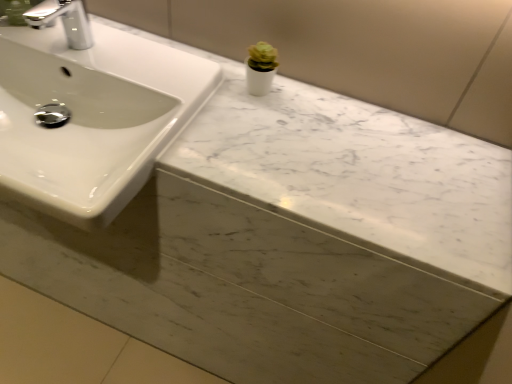
Question: Is silver metallic faucet at upper left looking in the opposite direction of white glossy sink at upper left?

Choices:
 (A) yes
 (B) no

Answer: (B)

Question: From the image's perspective, is silver metallic faucet at upper left on top of white glossy sink at upper left?

Choices:
 (A) yes
 (B) no

Answer: (A)

Question: Does silver metallic faucet at upper left come behind white glossy sink at upper left?

Choices:
 (A) no
 (B) yes

Answer: (B)

Question: Is silver metallic faucet at upper left wider than white glossy sink at upper left?

Choices:
 (A) no
 (B) yes

Answer: (A)

Question: Is silver metallic faucet at upper left far from white glossy sink at upper left?

Choices:
 (A) yes
 (B) no

Answer: (B)

Question: Does silver metallic faucet at upper left lie in front of white glossy sink at upper left?

Choices:
 (A) no
 (B) yes

Answer: (A)

Question: Can you confirm if white glossy sink at upper left is shorter than silver metallic faucet at upper left?

Choices:
 (A) yes
 (B) no

Answer: (B)

Question: Is white glossy sink at upper left facing away from silver metallic faucet at upper left?

Choices:
 (A) yes
 (B) no

Answer: (B)

Question: Does white glossy sink at upper left have a greater width compared to silver metallic faucet at upper left?

Choices:
 (A) yes
 (B) no

Answer: (A)

Question: Considering the relative positions of white glossy sink at upper left and silver metallic faucet at upper left in the image provided, is white glossy sink at upper left behind silver metallic faucet at upper left?

Choices:
 (A) no
 (B) yes

Answer: (A)

Question: From a real-world perspective, is white glossy sink at upper left located beneath silver metallic faucet at upper left?

Choices:
 (A) yes
 (B) no

Answer: (A)

Question: Is white glossy sink at upper left facing towards silver metallic faucet at upper left?

Choices:
 (A) yes
 (B) no

Answer: (B)

Question: From the image's perspective, is silver metallic faucet at upper left below white marble counter top at upper center?

Choices:
 (A) yes
 (B) no

Answer: (B)